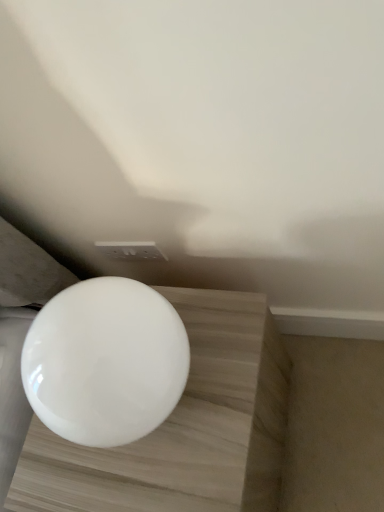
What do you see at coordinates (225, 403) in the screenshot?
I see `white glossy sphere at center` at bounding box center [225, 403].

At what (x,y) coordinates should I click in order to perform the action: click on white glossy sphere at center. Please return your answer as a coordinate pair (x, y). The height and width of the screenshot is (512, 384). Looking at the image, I should click on (225, 403).

What is the approximate width of white glossy toilet at center?

23.76 centimeters.

The image size is (384, 512). What do you see at coordinates (105, 362) in the screenshot? I see `white glossy toilet at center` at bounding box center [105, 362].

The image size is (384, 512). What are the coordinates of `white glossy toilet at center` in the screenshot? It's located at (105, 362).

Locate an element on the screen. The image size is (384, 512). white glossy sphere at center is located at coordinates (225, 403).

Can you confirm if white glossy toilet at center is positioned to the left of white glossy sphere at center?

Yes.

In the image, is white glossy toilet at center positioned in front of or behind white glossy sphere at center?

white glossy toilet at center is in front of white glossy sphere at center.

Is point (141, 419) more distant than point (207, 389)?

No, (141, 419) is in front of (207, 389).

From the image's perspective, is white glossy toilet at center above white glossy sphere at center?

Yes.

Consider the image. From a real-world perspective, between white glossy toilet at center and white glossy sphere at center, who is vertically higher?

From a 3D spatial view, white glossy toilet at center is above.

Looking at their sizes, would you say white glossy toilet at center is wider or thinner than white glossy sphere at center?

Clearly, white glossy toilet at center has less width compared to white glossy sphere at center.

Is white glossy toilet at center taller than white glossy sphere at center?

In fact, white glossy toilet at center may be shorter than white glossy sphere at center.

Considering the sizes of white glossy toilet at center and white glossy sphere at center in the image, is white glossy toilet at center bigger or smaller than white glossy sphere at center?

In the image, white glossy toilet at center appears to be smaller than white glossy sphere at center.

Can white glossy sphere at center be found inside white glossy toilet at center?

No, white glossy sphere at center is located outside of white glossy toilet at center.

Is white glossy toilet at center next to white glossy sphere at center?

No, white glossy toilet at center is not next to white glossy sphere at center.

Is white glossy toilet at center positioned with its back to white glossy sphere at center?

No, white glossy toilet at center is not facing away from white glossy sphere at center.

What's the angular difference between white glossy toilet at center and white glossy sphere at center's facing directions?

The facing directions of white glossy toilet at center and white glossy sphere at center are 1.2 degrees apart.

How distant is white glossy toilet at center from white glossy sphere at center?

white glossy toilet at center is 5.81 inches away from white glossy sphere at center.

I want to click on table below the white glossy toilet at center (from the image's perspective), so click(x=225, y=403).

Is white glossy sphere at center at the left side of white glossy toilet at center?

No, white glossy sphere at center is not to the left of white glossy toilet at center.

Which is in front, white glossy sphere at center or white glossy toilet at center?

white glossy toilet at center is more forward.

Which point is more distant from viewer, (277, 370) or (109, 355)?

The point (277, 370) is farther.

From the image's perspective, relative to white glossy toilet at center, is white glossy sphere at center above or below?

white glossy sphere at center is below white glossy toilet at center.

From a real-world perspective, between white glossy sphere at center and white glossy toilet at center, who is vertically higher?

From a 3D spatial view, white glossy toilet at center is above.

Consider the image. Which object is thinner, white glossy sphere at center or white glossy toilet at center?

Thinner between the two is white glossy toilet at center.

Between white glossy sphere at center and white glossy toilet at center, which one has more height?

Standing taller between the two is white glossy sphere at center.

Considering the sizes of objects white glossy sphere at center and white glossy toilet at center in the image provided, who is smaller, white glossy sphere at center or white glossy toilet at center?

white glossy toilet at center is smaller.

Is white glossy sphere at center surrounding white glossy toilet at center?

Actually, white glossy toilet at center is outside white glossy sphere at center.

Would you consider white glossy sphere at center to be distant from white glossy toilet at center?

No, there isn't a large distance between white glossy sphere at center and white glossy toilet at center.

Is white glossy toilet at center at the back of white glossy sphere at center?

No, white glossy sphere at center is not facing away from white glossy toilet at center.

Locate an element on the screen. toilet above the white glossy sphere at center (from the image's perspective) is located at coordinates (105, 362).

Where is `toilet that appears on the left of white glossy sphere at center`? toilet that appears on the left of white glossy sphere at center is located at coordinates (105, 362).

You are a GUI agent. You are given a task and a screenshot of the screen. Output one action in this format:
    pyautogui.click(x=<x>, y=<y>)
    Task: Click on the toilet above the white glossy sphere at center (from a real-world perspective)
    The image size is (384, 512).
    Given the screenshot: What is the action you would take?
    pyautogui.click(x=105, y=362)